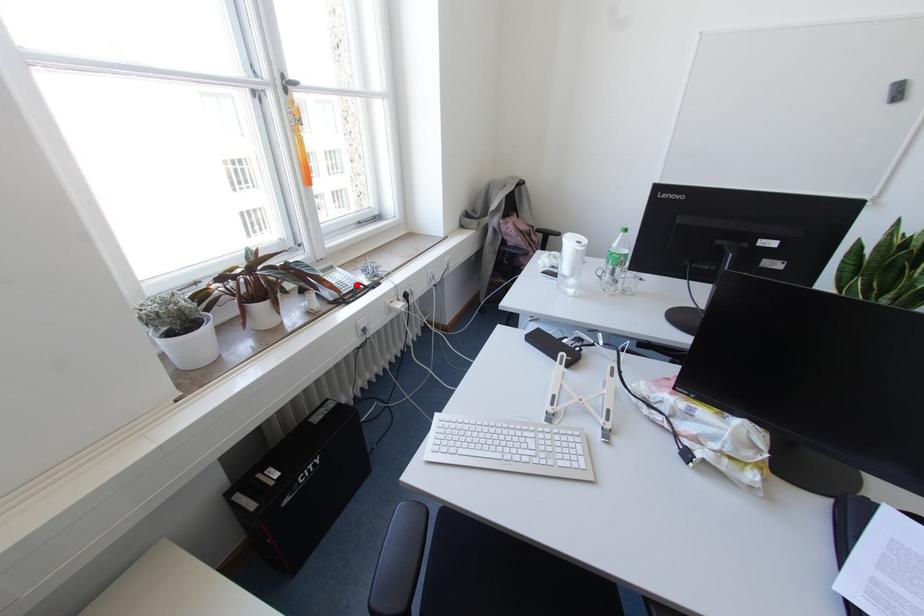
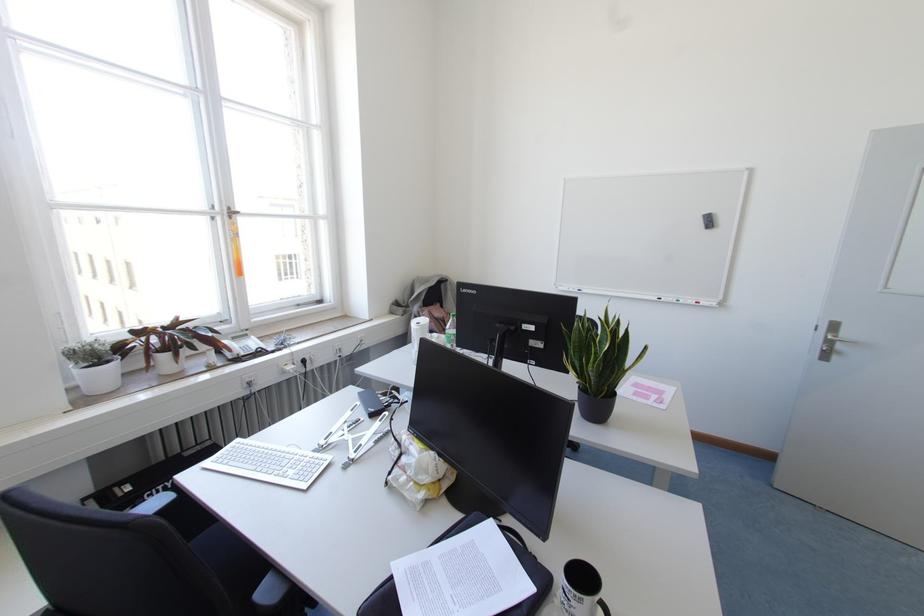
Where in the second image is the point corresponding to the highlighted location from the first image?

(258, 349)